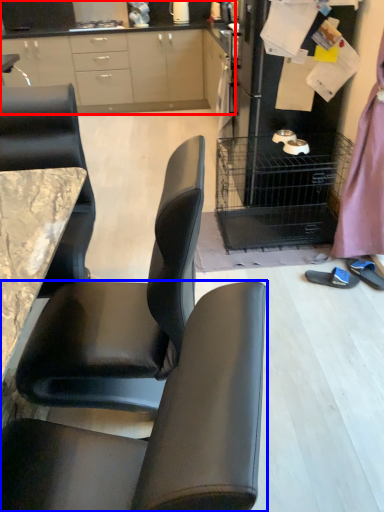
Question: Which of the following is the closest to the observer, cabinetry (highlighted by a red box) or chair (highlighted by a blue box)?

Choices:
 (A) cabinetry
 (B) chair

Answer: (B)